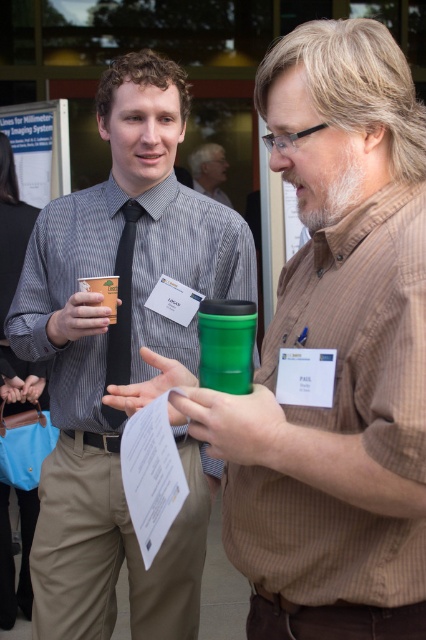
Question: Is matte black tie at left bigger than blackmaterialtie at left?

Choices:
 (A) no
 (B) yes

Answer: (B)

Question: Which of the following is the farthest from the observer?

Choices:
 (A) (357, 608)
 (B) (215, 388)
 (C) (193, 168)
 (D) (158, 257)

Answer: (C)

Question: Which of the following is the farthest from the observer?

Choices:
 (A) matte black tie at center
 (B) blackmaterialtie at left

Answer: (A)

Question: Is green plastic cup at center smaller than matte plastic cup at center?

Choices:
 (A) no
 (B) yes

Answer: (A)

Question: Is blackmaterialtie at left to the left of matte black tie at center from the viewer's perspective?

Choices:
 (A) no
 (B) yes

Answer: (B)

Question: Estimate the real-world distances between objects in this image. Which object is farther from the matte plastic cup at center?

Choices:
 (A) green matte cup at left
 (B) matte black tie at center
 (C) matte black tie at left

Answer: (B)